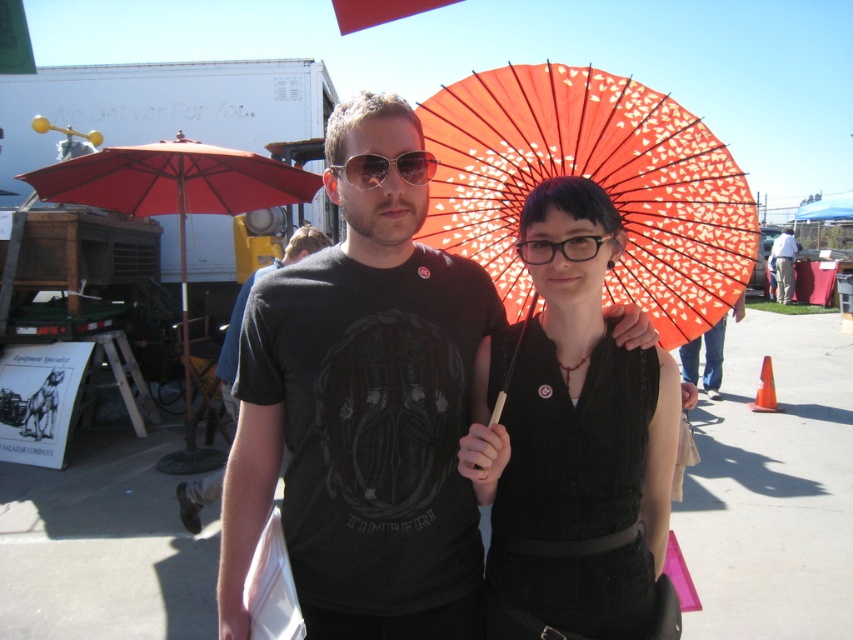
Can you confirm if orange paper parasol at center is shorter than metal aviator goggles at center?

In fact, orange paper parasol at center may be taller than metal aviator goggles at center.

Is orange paper parasol at center below metal aviator goggles at center?

Correct, orange paper parasol at center is located below metal aviator goggles at center.

Does point (564, 161) lie behind point (421, 156)?

Yes, it is behind point (421, 156).

The width and height of the screenshot is (853, 640). What are the coordinates of `orange paper parasol at center` in the screenshot? It's located at (595, 182).

Is matte black umbrella at center wider than dark gray t-shirt at center?

Correct, the width of matte black umbrella at center exceeds that of dark gray t-shirt at center.

Which of these two, matte black umbrella at center or dark gray t-shirt at center, stands shorter?

matte black umbrella at center

Is point (395, 132) positioned in front of point (776, 266)?

Yes, point (395, 132) is closer to viewer.

At what (x,y) coordinates should I click in order to perform the action: click on matte black umbrella at center. Please return your answer as a coordinate pair (x, y). The height and width of the screenshot is (640, 853). Looking at the image, I should click on (363, 428).

Can you confirm if matte black dress at center is taller than red fabric umbrella at left?

Correct, matte black dress at center is much taller as red fabric umbrella at left.

Does matte black dress at center have a lesser height compared to red fabric umbrella at left?

No, matte black dress at center is not shorter than red fabric umbrella at left.

Who is more distant from viewer, (560, 209) or (165, 467)?

Positioned behind is point (165, 467).

Locate an element on the screen. Image resolution: width=853 pixels, height=640 pixels. matte black dress at center is located at coordinates (573, 449).